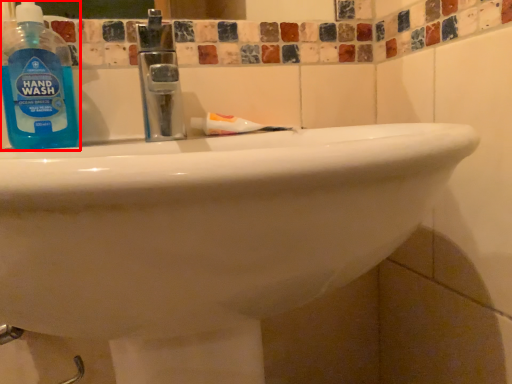
Question: Observing the image, what is the correct spatial positioning of cleaning product (annotated by the red box) in reference to toothpaste?

Choices:
 (A) left
 (B) right

Answer: (A)